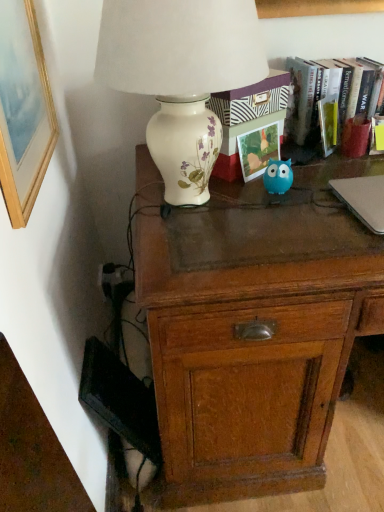
You are a GUI agent. You are given a task and a screenshot of the screen. Output one action in this format:
    pyautogui.click(x=<x>, y=<y>)
    Task: Click on the free space above wooden desk at center (from a real-world perspective)
    This screenshot has width=384, height=512.
    Given the screenshot: What is the action you would take?
    pyautogui.click(x=284, y=200)